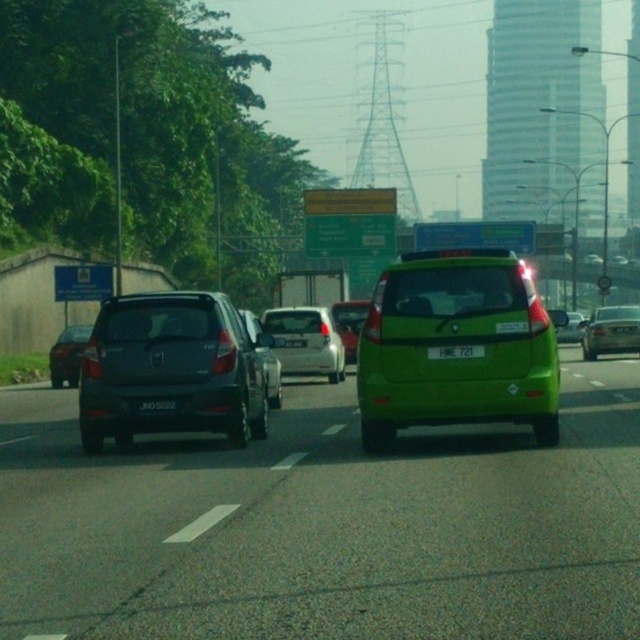
You are a driver approaching the green car with license plate HME 721 and the black car with license plate JNO 5222. You notice a white plastic license plate at center located at point (456, 352). Can you determine which car this license plate belongs to based on their positions?

The white plastic license plate at center located at point (456, 352) belongs to the green car with license plate HME 721 because it is closer to that car compared to the black car with license plate JNO 5222.

You are a pedestrian standing at the edge of the highway near the green car with license plate HME 721. You want to cross the road to reach the point marked at coordinates (444,419). Given that the road is 10 meters wide, can you safely cross before the cars move again?

The point marked at coordinates (444,419) is 13.16 meters away from the viewer. Since the road is 10 meters wide, the pedestrian would need to cross 10 meters to reach the other side, but the total distance to the point is 13.16 meters. Therefore, the pedestrian can safely cross before the cars move again as the required crossing distance is within the available distance.

You are a driver approaching the highway and notice the white plastic license plate at center and the green matte van at center ahead. Which object appears smaller in height from your perspective?

The white plastic license plate at center has a lesser height compared to the green matte van at center, so it appears smaller in height.